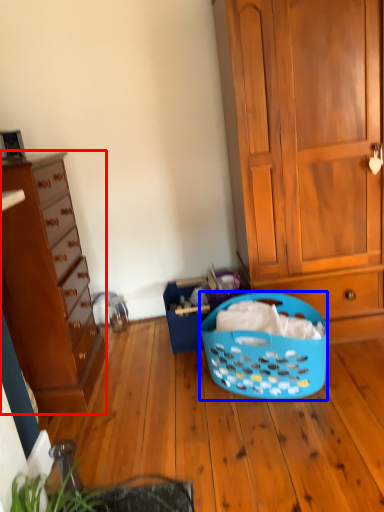
Question: Which object is closer to the camera taking this photo, cabinetry (highlighted by a red box) or picnic basket (highlighted by a blue box)?

Choices:
 (A) cabinetry
 (B) picnic basket

Answer: (A)